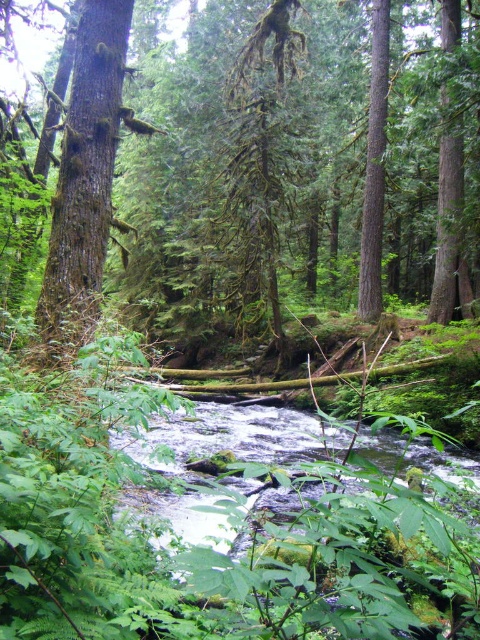
You are a hiker who wants to cross the stream. You see the clear water at center and the smooth brown tree trunk at left. Which object is on the left side when looking at the stream from the bottom right?

The smooth brown tree trunk at left is on the left side when looking at the stream from the bottom right because the clear water at center is positioned to its right.

You are standing in the forest and want to take a photo of the green mossy tree at center. If your camera has a maximum focus range of 15 feet, will you need to move closer to the tree to capture it clearly?

The green mossy tree at center is 17.41 feet away from the viewer, which exceeds the camera maximum focus range of 15 feet. Therefore, you need to move closer to the tree to capture it clearly.

You are a hiker carrying a 10 meter long rope. You need to cross the stream but there is a gap between the green mossy tree at center and the smooth brown tree trunk at left. Can you use your rope to bridge the gap?

The distance between the green mossy tree at center and the smooth brown tree trunk at left is 10.70 meters. Since your rope is only 10 meters long, it is 70 centimeters short. Therefore, the rope cannot bridge the gap.